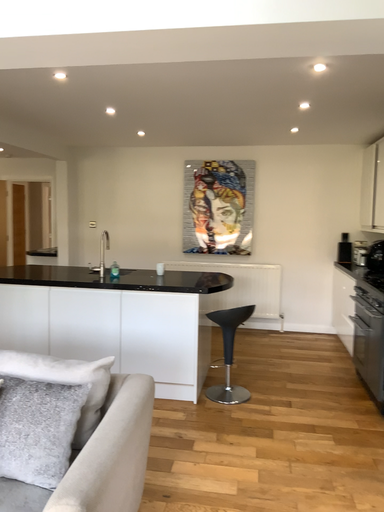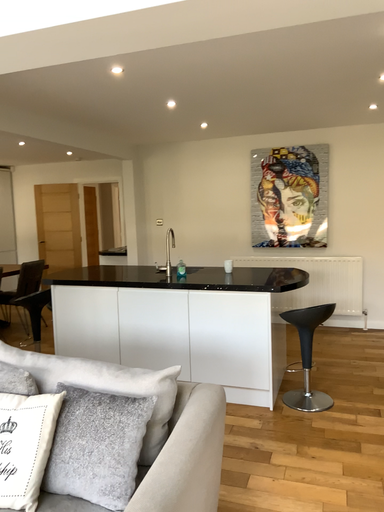
Question: Which way did the camera rotate in the video?

Choices:
 (A) rotated right
 (B) rotated left

Answer: (B)